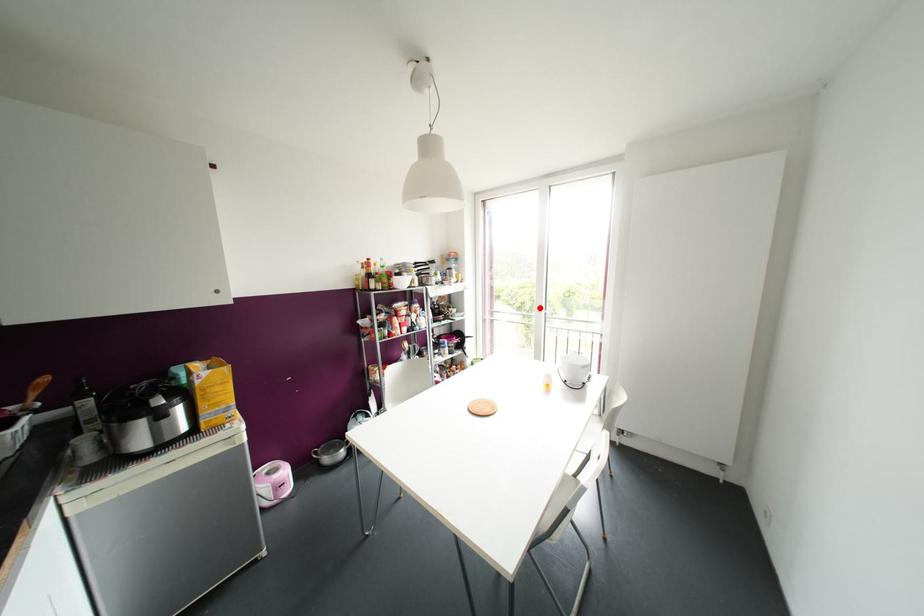
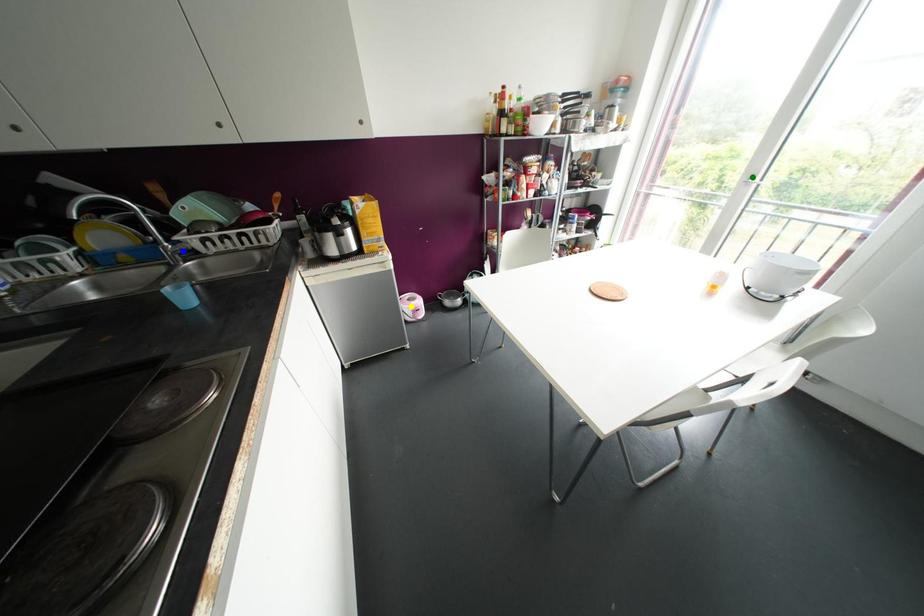
Question: I am providing you with two images of the same scene from different viewpoints. A red point is marked on the first image. You are given multiple points on the second image. Which spot in image 2 lines up with the point in image 1?

Choices:
 (A) blue point
 (B) yellow point
 (C) green point

Answer: (C)